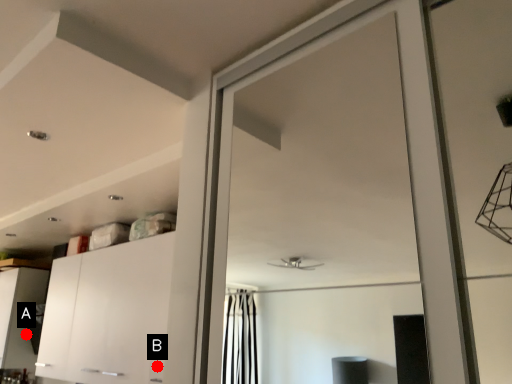
Question: Two points are circled on the image, labeled by A and B beside each circle. Which of the following is the farthest from the observer?

Choices:
 (A) A is further
 (B) B is further

Answer: (A)